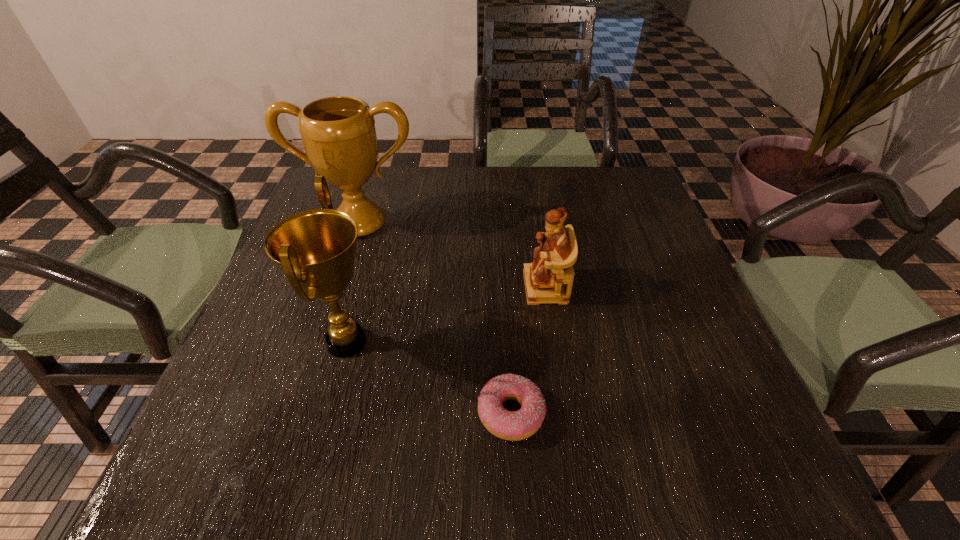
Identify the location of free space that is in between the farther award and the figurine. (452, 255).

The image size is (960, 540). I want to click on vacant region between the farthest object and the doughnut, so click(x=436, y=318).

At what (x,y) coordinates should I click in order to perform the action: click on vacant space in between the figurine and the shortest object. Please return your answer as a coordinate pair (x, y). This screenshot has height=540, width=960. Looking at the image, I should click on (528, 350).

Locate an element on the screen. vacant space that's between the nearer award and the shortest object is located at coordinates (429, 377).

Identify the location of vacant point located between the shortest object and the nearer award. This screenshot has width=960, height=540. (429, 377).

Locate an element on the screen. vacant space that is in between the figurine and the farthest object is located at coordinates (452, 255).

Identify the location of vacant space that is in between the doughnut and the farther award. Image resolution: width=960 pixels, height=540 pixels. (436, 318).

Find the location of a particular element. free area in between the shortest object and the nearer award is located at coordinates (429, 377).

Point out which object is positioned as the second nearest to the figurine. Please provide its 2D coordinates. Your answer should be formatted as a tuple, i.e. [(x, y)], where the tuple contains the x and y coordinates of a point satisfying the conditions above.

[(338, 133)]

Point out which object is positioned as the nearest to the nearer award. Please provide its 2D coordinates. Your answer should be formatted as a tuple, i.e. [(x, y)], where the tuple contains the x and y coordinates of a point satisfying the conditions above.

[(518, 425)]